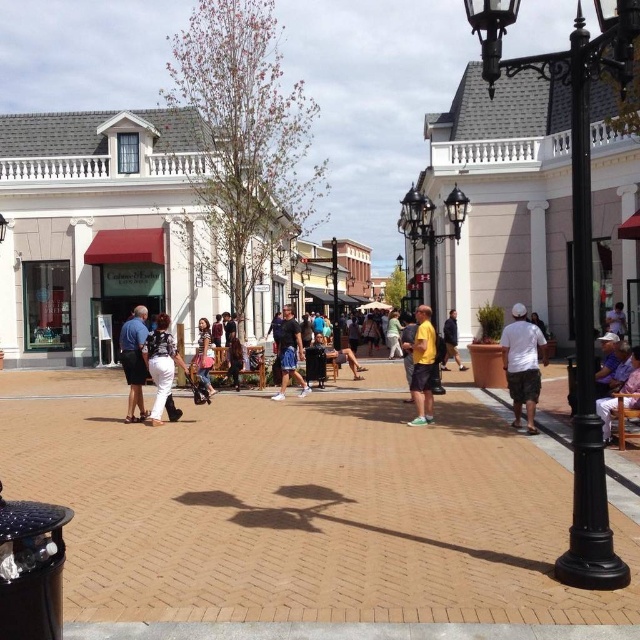
You are a customer in the plaza and want to sit down. You see the matte black shorts at center and the purple fabric chair at lower right. Which object is larger?

The matte black shorts at center is bigger than the purple fabric chair at lower right.

You are a customer looking to buy a shirt in this plaza. You see a yellow matte shirt at center and a light blue shirt at center. Which shirt is located to the left of the other?

The yellow matte shirt at center is positioned on the left side of light blue shirt at center.

You are standing at the bottom left corner of the plaza and want to find the yellow matte shirt at center. Which direction should you walk to reach it?

Since the yellow matte shirt at center is located at point 2D coordinates of (422, 365), you should walk towards the center of the plaza from the bottom left corner to reach it.